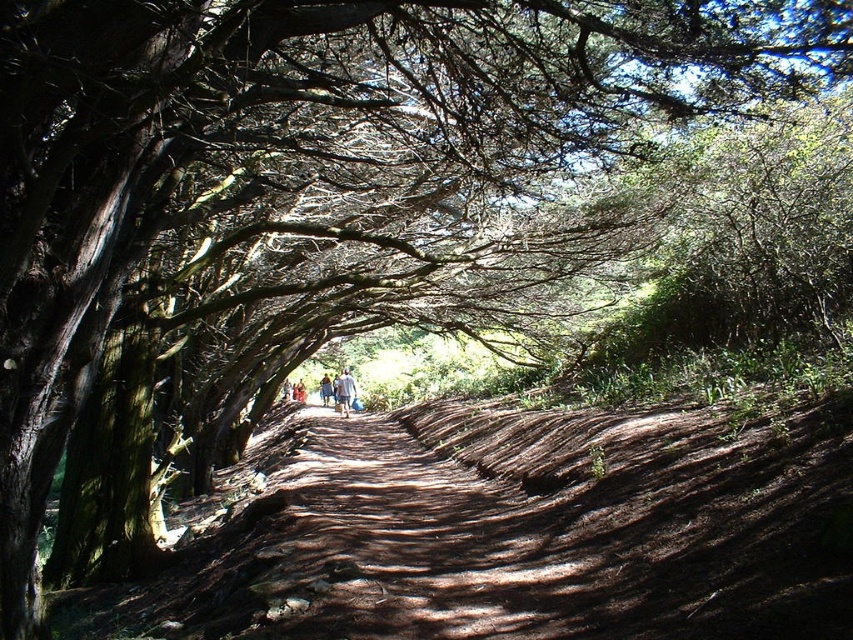
Who is positioned more to the left, light blue fabric at center or light blue denim jeans at center?

Positioned to the left is light blue denim jeans at center.

Is point (338, 396) positioned after point (318, 394)?

No, (338, 396) is closer to viewer.

Find the location of a particular element. The width and height of the screenshot is (853, 640). light blue fabric at center is located at coordinates point(344,392).